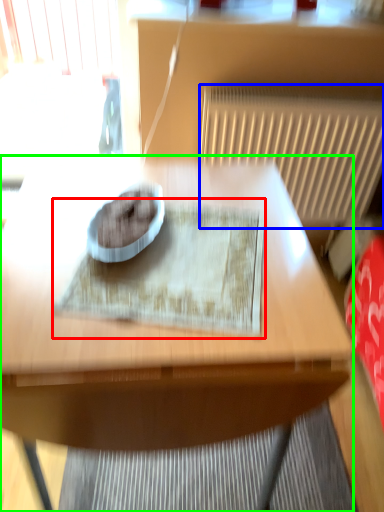
Question: Which object is positioned farthest from mat (highlighted by a red box)? Select from radiator (highlighted by a blue box) and table (highlighted by a green box).

Choices:
 (A) radiator
 (B) table

Answer: (A)